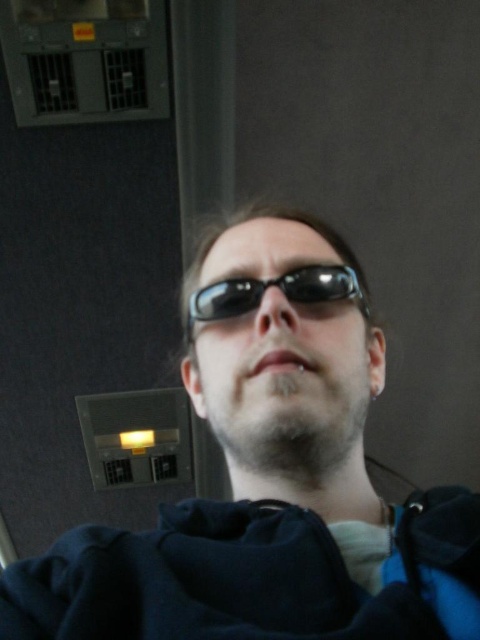
Question: Which object is farther from the camera taking this photo?

Choices:
 (A) black reflective sunglasses at center
 (B) matte black sunglasses at center

Answer: (A)

Question: Which of the following is the farthest from the observer?

Choices:
 (A) black reflective sunglasses at center
 (B) matte black sunglasses at center

Answer: (A)

Question: Does matte black sunglasses at center have a smaller size compared to black reflective sunglasses at center?

Choices:
 (A) no
 (B) yes

Answer: (A)

Question: Is matte black sunglasses at center smaller than black reflective sunglasses at center?

Choices:
 (A) yes
 (B) no

Answer: (B)

Question: Is matte black sunglasses at center below black reflective sunglasses at center?

Choices:
 (A) yes
 (B) no

Answer: (A)

Question: Which point is closer to the camera taking this photo?

Choices:
 (A) (241, 333)
 (B) (204, 312)

Answer: (A)